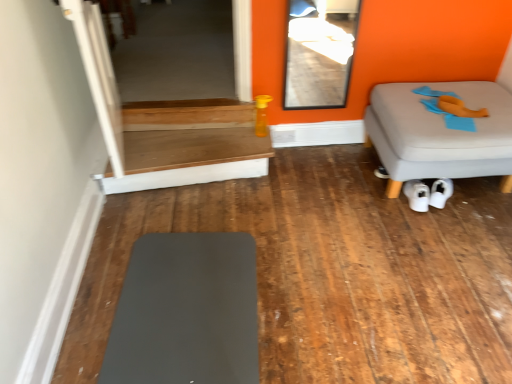
How much space does matte gray mat at lower left, marked as the second furniture in a right-to-left arrangement, occupy vertically?

It is 1.40 inches.

The image size is (512, 384). I want to click on wooden table at center, so click(188, 158).

How much space does transparent glass door at upper left, which is the 1th glass door from back to front, occupy vertically?

transparent glass door at upper left, which is the 1th glass door from back to front, is 2.33 inches tall.

You are a GUI agent. You are given a task and a screenshot of the screen. Output one action in this format:
    pyautogui.click(x=<x>, y=<y>)
    Task: Click on the transparent glass door at upper center, marked as the 1th glass door in a right-to-left arrangement
    The width and height of the screenshot is (512, 384).
    Given the screenshot: What is the action you would take?
    pyautogui.click(x=319, y=52)

Find the location of a particular element. matte gray mat at lower left, the 2th furniture positioned from the back is located at coordinates (186, 312).

Is matte gray mat at lower left, which appears as the 2th furniture when viewed from the top, a part of wooden table at center?

No, matte gray mat at lower left, which appears as the 2th furniture when viewed from the top, is located outside of wooden table at center.

Is wooden table at center wider or thinner than matte gray mat at lower left, which appears as the 2th furniture when viewed from the top?

In the image, wooden table at center appears to be more narrow than matte gray mat at lower left, which appears as the 2th furniture when viewed from the top.

Are wooden table at center and matte gray mat at lower left, the 2th furniture positioned from the back, located far from each other?

Actually, wooden table at center and matte gray mat at lower left, the 2th furniture positioned from the back, are a little close together.

Is wooden table at center positioned in front of matte gray mat at lower left, acting as the first furniture starting from the bottom?

That is False.

Locate an element on the screen. This screenshot has width=512, height=384. table below the gray fabric ottoman at right, the 2th furniture viewed from the front (from the image's perspective) is located at coordinates (188, 158).

From their relative heights in the image, would you say wooden table at center is taller or shorter than gray fabric ottoman at right, the 2th furniture when ordered from left to right?

In the image, wooden table at center appears to be shorter than gray fabric ottoman at right, the 2th furniture when ordered from left to right.

Considering the sizes of objects wooden table at center and gray fabric ottoman at right, the 2th furniture viewed from the front, in the image provided, who is bigger, wooden table at center or gray fabric ottoman at right, the 2th furniture viewed from the front,?

gray fabric ottoman at right, the 2th furniture viewed from the front.

Are wooden table at center and gray fabric ottoman at right, which appears as the first furniture when viewed from the back, located far from each other?

That's right, there is a large distance between wooden table at center and gray fabric ottoman at right, which appears as the first furniture when viewed from the back.

Considering the positions of objects transparent glass door at upper left, which is the first glass door from left to right, and wooden table at center in the image provided, who is more to the right, transparent glass door at upper left, which is the first glass door from left to right, or wooden table at center?

wooden table at center is more to the right.

Is point (110, 110) closer or farther from the camera than point (217, 128)?

Clearly, point (110, 110) is closer to the camera than point (217, 128).

Considering the sizes of transparent glass door at upper left, the second glass door viewed from the front, and wooden table at center in the image, is transparent glass door at upper left, the second glass door viewed from the front, taller or shorter than wooden table at center?

Clearly, transparent glass door at upper left, the second glass door viewed from the front, is shorter compared to wooden table at center.

Is transparent glass door at upper left, the second glass door viewed from the front, positioned behind wooden table at center?

Yes, it is behind wooden table at center.

Is gray fabric ottoman at right, the 2th furniture viewed from the front, a part of matte gray mat at lower left, the first furniture from the front?

No, gray fabric ottoman at right, the 2th furniture viewed from the front, is not inside matte gray mat at lower left, the first furniture from the front.

Considering the relative sizes of matte gray mat at lower left, the 2th furniture positioned from the back, and gray fabric ottoman at right, which appears as the first furniture when viewed from the back, in the image provided, is matte gray mat at lower left, the 2th furniture positioned from the back, wider than gray fabric ottoman at right, which appears as the first furniture when viewed from the back,?

Correct, the width of matte gray mat at lower left, the 2th furniture positioned from the back, exceeds that of gray fabric ottoman at right, which appears as the first furniture when viewed from the back.

Find the location of `furniture that is under the gray fabric ottoman at right, the first furniture in the top-to-bottom sequence (from a real-world perspective)`. furniture that is under the gray fabric ottoman at right, the first furniture in the top-to-bottom sequence (from a real-world perspective) is located at coordinates (186, 312).

In the scene shown: From the image's perspective, which is above, white matte sneakers at lower center or transparent glass door at upper left, which is the 1th glass door from back to front?

transparent glass door at upper left, which is the 1th glass door from back to front, from the image's perspective.

How far apart are white matte sneakers at lower center and transparent glass door at upper left, which is the first glass door from left to right?

white matte sneakers at lower center is 4.59 feet away from transparent glass door at upper left, which is the first glass door from left to right.

Is white matte sneakers at lower center further to the viewer compared to transparent glass door at upper left, placed as the 2th glass door when sorted from right to left?

No, white matte sneakers at lower center is closer to the viewer.

Which is more to the left, white matte sneakers at lower center or transparent glass door at upper left, placed as the 2th glass door when sorted from right to left?

From the viewer's perspective, transparent glass door at upper left, placed as the 2th glass door when sorted from right to left, appears more on the left side.

Considering the relative sizes of transparent glass door at upper center, the 1th glass door viewed from the front, and wooden table at center in the image provided, is transparent glass door at upper center, the 1th glass door viewed from the front, taller than wooden table at center?

Yes, transparent glass door at upper center, the 1th glass door viewed from the front, is taller than wooden table at center.

From a real-world perspective, which is physically above, transparent glass door at upper center, placed as the second glass door when sorted from left to right, or wooden table at center?

In real-world perspective, transparent glass door at upper center, placed as the second glass door when sorted from left to right, is above.

Considering the relative positions of transparent glass door at upper center, the 1th glass door viewed from the front, and wooden table at center in the image provided, is transparent glass door at upper center, the 1th glass door viewed from the front, behind wooden table at center?

That is False.

Considering the relative sizes of transparent glass door at upper center, the 1th glass door viewed from the front, and wooden table at center in the image provided, is transparent glass door at upper center, the 1th glass door viewed from the front, smaller than wooden table at center?

Correct, transparent glass door at upper center, the 1th glass door viewed from the front, occupies less space than wooden table at center.

From a real-world perspective, does transparent glass door at upper center, arranged as the second glass door when viewed from the back, sit lower than transparent glass door at upper left, the second glass door viewed from the front?

No, from a real-world perspective, transparent glass door at upper center, arranged as the second glass door when viewed from the back, is not beneath transparent glass door at upper left, the second glass door viewed from the front.

Is transparent glass door at upper center, arranged as the second glass door when viewed from the back, taller or shorter than transparent glass door at upper left, the second glass door viewed from the front?

transparent glass door at upper center, arranged as the second glass door when viewed from the back, is taller than transparent glass door at upper left, the second glass door viewed from the front.

In the image, is transparent glass door at upper center, marked as the 1th glass door in a right-to-left arrangement, on the left side or the right side of transparent glass door at upper left, the second glass door viewed from the front?

From the image, it's evident that transparent glass door at upper center, marked as the 1th glass door in a right-to-left arrangement, is to the right of transparent glass door at upper left, the second glass door viewed from the front.

Based on the photo, in the image, is transparent glass door at upper center, placed as the second glass door when sorted from left to right, positioned in front of or behind transparent glass door at upper left, the second glass door viewed from the front?

transparent glass door at upper center, placed as the second glass door when sorted from left to right, is in front of transparent glass door at upper left, the second glass door viewed from the front.

This screenshot has width=512, height=384. In order to click on table positioned vertically above the matte gray mat at lower left, which appears as the 2th furniture when viewed from the top (from a real-world perspective) in this screenshot , I will do `click(188, 158)`.

Image resolution: width=512 pixels, height=384 pixels. What are the coordinates of `the 1st furniture in front when counting from the wooden table at center` in the screenshot? It's located at (440, 134).

Considering their positions, is wooden table at center positioned closer to matte gray mat at lower left, marked as the second furniture in a right-to-left arrangement, than gray fabric ottoman at right, acting as the 1th furniture starting from the right?

wooden table at center is positioned closer to the anchor matte gray mat at lower left, marked as the second furniture in a right-to-left arrangement.

Looking at the image, which one is located further to matte gray mat at lower left, the first furniture from the front, white matte sneakers at lower center or gray fabric ottoman at right, which appears as the first furniture when viewed from the back?

white matte sneakers at lower center.

Considering their positions, is matte gray mat at lower left, acting as the first furniture starting from the bottom, positioned closer to wooden table at center than transparent glass door at upper center, the 1th glass door viewed from the front?

Among the two, matte gray mat at lower left, acting as the first furniture starting from the bottom, is located nearer to wooden table at center.

When comparing their distances from gray fabric ottoman at right, the 2th furniture viewed from the front, does transparent glass door at upper center, marked as the 1th glass door in a right-to-left arrangement, or wooden table at center seem further?

transparent glass door at upper center, marked as the 1th glass door in a right-to-left arrangement, is positioned further to the anchor gray fabric ottoman at right, the 2th furniture viewed from the front.

Based on their spatial positions, is transparent glass door at upper left, placed as the 2th glass door when sorted from right to left, or transparent glass door at upper center, placed as the second glass door when sorted from left to right, further from gray fabric ottoman at right, the 2th furniture when ordered from left to right?

Based on the image, transparent glass door at upper center, placed as the second glass door when sorted from left to right, appears to be further to gray fabric ottoman at right, the 2th furniture when ordered from left to right.

Estimate the real-world distances between objects in this image. Which object is further from white matte sneakers at lower center, transparent glass door at upper left, which is the 1th glass door from back to front, or gray fabric ottoman at right, the 2th furniture viewed from the front?

transparent glass door at upper left, which is the 1th glass door from back to front, lies further to white matte sneakers at lower center than the other object.

Considering their positions, is transparent glass door at upper center, arranged as the second glass door when viewed from the back, positioned closer to wooden table at center than gray fabric ottoman at right, the first furniture in the top-to-bottom sequence?

The object closer to wooden table at center is gray fabric ottoman at right, the first furniture in the top-to-bottom sequence.

Considering their positions, is wooden table at center positioned further to transparent glass door at upper center, marked as the 1th glass door in a right-to-left arrangement, than matte gray mat at lower left, marked as the first furniture in a left-to-right arrangement?

Among the two, matte gray mat at lower left, marked as the first furniture in a left-to-right arrangement, is located further to transparent glass door at upper center, marked as the 1th glass door in a right-to-left arrangement.

Find the location of a particular element. The height and width of the screenshot is (384, 512). glass door between transparent glass door at upper left, which is the 1th glass door from back to front, and wooden table at center vertically is located at coordinates (319, 52).

Image resolution: width=512 pixels, height=384 pixels. I want to click on furniture between transparent glass door at upper left, placed as the 2th glass door when sorted from right to left, and gray fabric ottoman at right, acting as the 1th furniture starting from the right, from left to right, so click(186, 312).

The width and height of the screenshot is (512, 384). Find the location of `table that lies between transparent glass door at upper left, placed as the 2th glass door when sorted from right to left, and matte gray mat at lower left, marked as the first furniture in a left-to-right arrangement, from top to bottom`. table that lies between transparent glass door at upper left, placed as the 2th glass door when sorted from right to left, and matte gray mat at lower left, marked as the first furniture in a left-to-right arrangement, from top to bottom is located at coordinates (188, 158).

Identify the location of table located between transparent glass door at upper left, which is the 1th glass door from back to front, and white matte sneakers at lower center in the left-right direction. (188, 158).